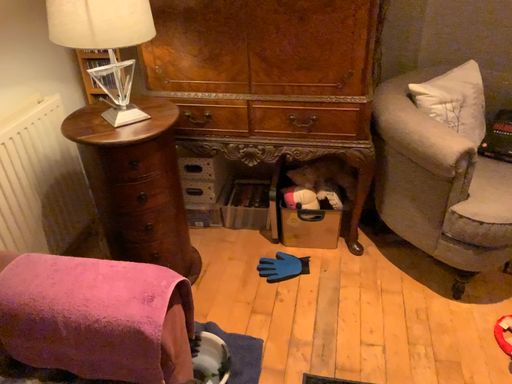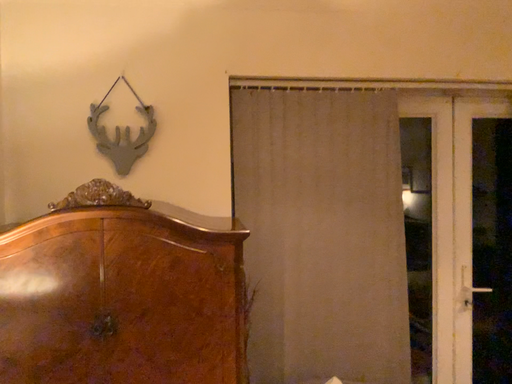
Question: How did the camera likely rotate when shooting the video?

Choices:
 (A) rotated downward
 (B) rotated upward

Answer: (B)